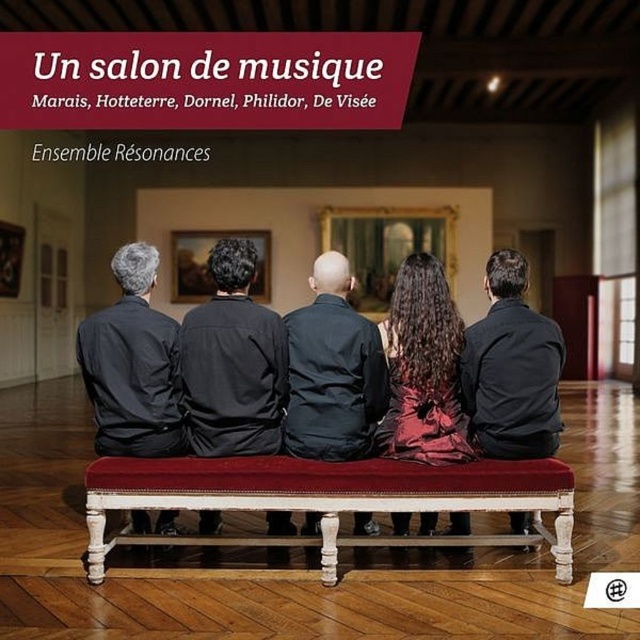
Question: Is the position of black matte jacket at center less distant than that of dark gray fabric jacket at center?

Choices:
 (A) no
 (B) yes

Answer: (B)

Question: Which point appears farthest from the camera in this image?

Choices:
 (A) pyautogui.click(x=515, y=422)
 (B) pyautogui.click(x=168, y=528)

Answer: (B)

Question: Can you confirm if velvet-covered bench at center is bigger than black matte shirt at center?

Choices:
 (A) yes
 (B) no

Answer: (A)

Question: Which object appears closest to the camera in this image?

Choices:
 (A) matte black shirt at left
 (B) black matte shirt at center
 (C) dark gray fabric jacket at center

Answer: (A)

Question: From the image, what is the correct spatial relationship of matte black shirt at left in relation to dark gray fabric jacket at center?

Choices:
 (A) right
 (B) left

Answer: (B)

Question: Which point is closer to the camera taking this photo?

Choices:
 (A) (276, 461)
 (B) (317, 358)

Answer: (A)